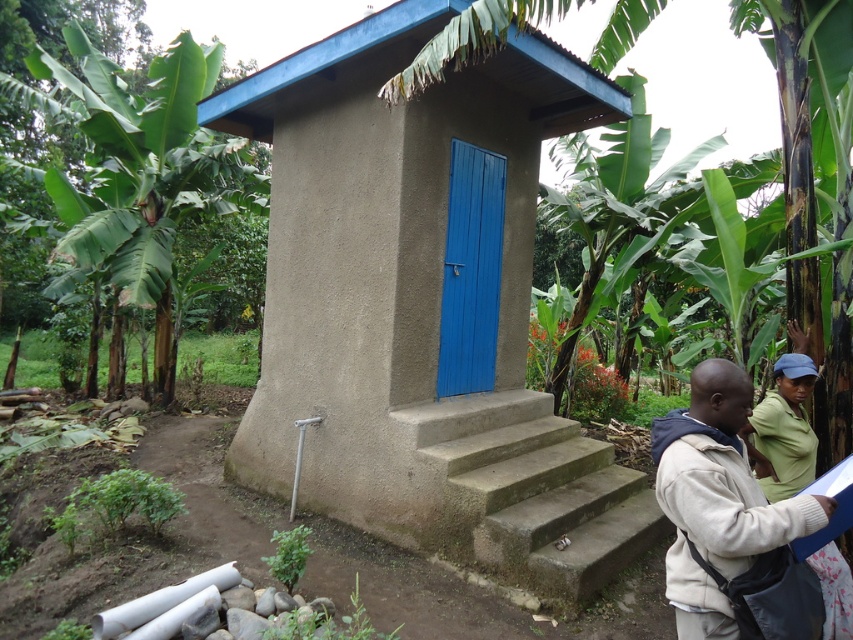
Measure the distance from matte concrete hut at center to green matte shirt at lower right.

7.34 feet

Can you confirm if matte concrete hut at center is taller than green matte shirt at lower right?

Yes, matte concrete hut at center is taller than green matte shirt at lower right.

What do you see at coordinates (424, 305) in the screenshot? I see `matte concrete hut at center` at bounding box center [424, 305].

This screenshot has height=640, width=853. Identify the location of matte concrete hut at center. (424, 305).

Who is positioned more to the right, matte concrete hut at center or green leafy banana tree at left?

From the viewer's perspective, matte concrete hut at center appears more on the right side.

Can you confirm if matte concrete hut at center is positioned above green leafy banana tree at left?

Incorrect, matte concrete hut at center is not positioned above green leafy banana tree at left.

What do you see at coordinates (424, 305) in the screenshot? I see `matte concrete hut at center` at bounding box center [424, 305].

What are the coordinates of `matte concrete hut at center` in the screenshot? It's located at (424, 305).

Does concrete stairs at center appear on the right side of green leafy banana tree at left?

Yes, concrete stairs at center is to the right of green leafy banana tree at left.

Is point (456, 531) closer to camera compared to point (167, 248)?

Yes, it is.

I want to click on concrete stairs at center, so click(x=521, y=492).